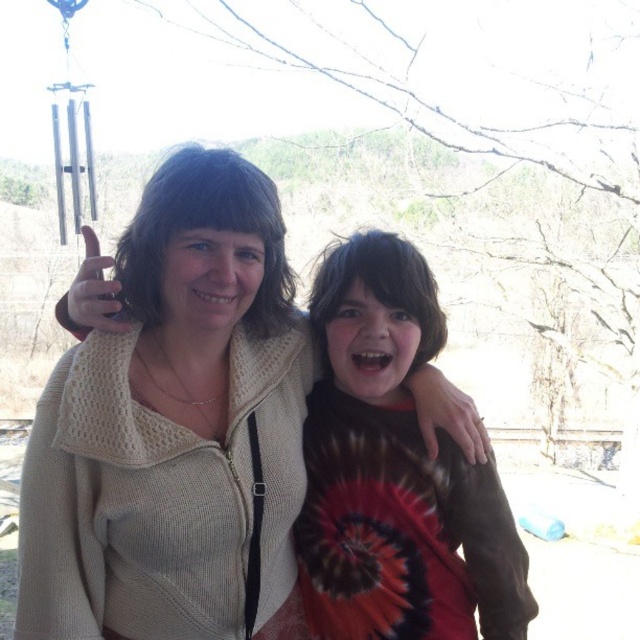
Question: Among these points, which one is nearest to the camera?

Choices:
 (A) (230, 205)
 (B) (429, 433)
 (C) (504, 570)
 (D) (96, 252)

Answer: (A)

Question: Which point appears closest to the camera in this image?

Choices:
 (A) click(429, 410)
 (B) click(180, 477)
 (C) click(72, 284)

Answer: (B)

Question: Does matte brown hand at center have a larger size compared to matte skin hand at upper left?

Choices:
 (A) no
 (B) yes

Answer: (A)

Question: Is white knitted sweater at center positioned at the back of tie-dye fabric shirt at center?

Choices:
 (A) yes
 (B) no

Answer: (B)

Question: Does tie-dye fabric shirt at center have a larger size compared to matte skin hand at upper left?

Choices:
 (A) no
 (B) yes

Answer: (B)

Question: Which of the following is the closest to the observer?

Choices:
 (A) tie-dye fabric shirt at center
 (B) white knitted sweater at center
 (C) matte brown hand at center
 (D) matte skin hand at upper left

Answer: (B)